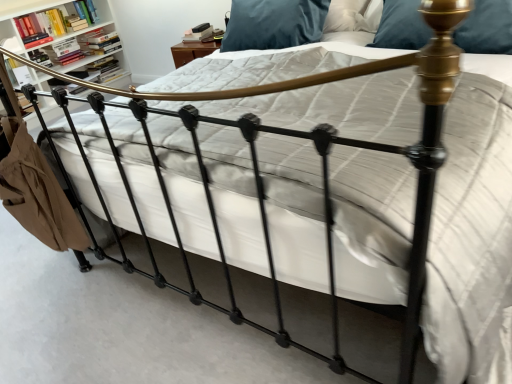
Describe the element at coordinates (99, 42) in the screenshot. This screenshot has height=384, width=512. I see `hardcover book at upper left, which is the 2th book in back-to-front order` at that location.

This screenshot has width=512, height=384. Describe the element at coordinates (55, 23) in the screenshot. I see `hardcover book at upper left, the first book viewed from the front` at that location.

This screenshot has width=512, height=384. What do you see at coordinates (54, 28) in the screenshot? I see `metallic bookshelf at upper left` at bounding box center [54, 28].

You are a GUI agent. You are given a task and a screenshot of the screen. Output one action in this format:
    pyautogui.click(x=<x>, y=<y>)
    Task: Click on the metallic bookshelf at upper left
    
    Given the screenshot: What is the action you would take?
    pyautogui.click(x=54, y=28)

Image resolution: width=512 pixels, height=384 pixels. In order to click on hardcover book at upper left, marked as the 2th book in a front-to-back arrangement in this screenshot , I will do `click(64, 52)`.

From a real-world perspective, which is physically above, hardcover book at upper left, which is the 3th book in back-to-front order, or metallic bookshelf at upper left?

In real-world perspective, hardcover book at upper left, which is the 3th book in back-to-front order, is above.

Choose the correct answer: Is hardcover book at upper left, marked as the 2th book in a front-to-back arrangement, inside metallic bookshelf at upper left or outside it?

hardcover book at upper left, marked as the 2th book in a front-to-back arrangement, is inside metallic bookshelf at upper left.

Looking at this image, considering the relative positions of hardcover book at upper left, which is the 3th book in back-to-front order, and metallic bookshelf at upper left in the image provided, is hardcover book at upper left, which is the 3th book in back-to-front order, to the right of metallic bookshelf at upper left from the viewer's perspective?

Yes.

Is hardcover book at upper left, the first book viewed from the front, looking in the opposite direction of metallic bookshelf at upper left?

That's right, hardcover book at upper left, the first book viewed from the front, is facing away from metallic bookshelf at upper left.

In the scene shown: From a real-world perspective, which object rests below the other?

From a 3D spatial view, metallic bookshelf at upper left is below.

How much distance is there between hardcover book at upper left, the 4th book when ordered from back to front, and metallic bookshelf at upper left?

The distance of hardcover book at upper left, the 4th book when ordered from back to front, from metallic bookshelf at upper left is 1.89 inches.

Is hardcover book at upper left, which is the 2th book in back-to-front order, to the left of velvet blue pillow at upper right from the viewer's perspective?

Indeed, hardcover book at upper left, which is the 2th book in back-to-front order, is positioned on the left side of velvet blue pillow at upper right.

Does point (104, 37) come farther from viewer compared to point (393, 4)?

That is True.

Can you confirm if hardcover book at upper left, which is the 2th book in back-to-front order, is shorter than velvet blue pillow at upper right?

Indeed, hardcover book at upper left, which is the 2th book in back-to-front order, has a lesser height compared to velvet blue pillow at upper right.

Is hardcover book at upper left, the 3th book from the front, oriented towards velvet blue pillow at upper right?

Yes.

From a real-world perspective, is hardcover book at upper left, marked as the 2th book in a front-to-back arrangement, under velvet blue pillow at upper right?

Indeed, from a real-world perspective, hardcover book at upper left, marked as the 2th book in a front-to-back arrangement, is positioned beneath velvet blue pillow at upper right.

Is hardcover book at upper left, which is the 3th book in back-to-front order, oriented away from velvet blue pillow at upper right?

That's not correct — hardcover book at upper left, which is the 3th book in back-to-front order, is not looking away from velvet blue pillow at upper right.

Who is smaller, hardcover book at upper left, which is the 3th book in back-to-front order, or velvet blue pillow at upper right?

hardcover book at upper left, which is the 3th book in back-to-front order.

Is hardcover book at upper left, marked as the 2th book in a front-to-back arrangement, far from velvet blue pillow at upper right?

Absolutely, hardcover book at upper left, marked as the 2th book in a front-to-back arrangement, is distant from velvet blue pillow at upper right.

What's the angular difference between hardcover books at upper left, placed as the fourth book when sorted from front to back, and velvet blue pillow at upper right's facing directions?

Result: 77.4 degrees.

Identify the location of book that is the 1st one when counting upward from the velvet blue pillow at upper right (from the image's perspective). (106, 69).

Can you confirm if hardcover books at upper left, placed as the fourth book when sorted from front to back, is wider than velvet blue pillow at upper right?

In fact, hardcover books at upper left, placed as the fourth book when sorted from front to back, might be narrower than velvet blue pillow at upper right.

Who is shorter, hardcover book at upper left, the 4th book when ordered from back to front, or hardcover book at upper left, the 3th book from the front?

Standing shorter between the two is hardcover book at upper left, the 3th book from the front.

Can you confirm if hardcover book at upper left, the first book viewed from the front, is thinner than hardcover book at upper left, which is the 2th book in back-to-front order?

Yes.

From the image's perspective, which one is positioned lower, hardcover book at upper left, the first book viewed from the front, or hardcover book at upper left, the 3th book from the front?

From the image's view, hardcover book at upper left, the first book viewed from the front, is below.

Looking at this image, does hardcover book at upper left, marked as the 2th book in a front-to-back arrangement, turn towards hardcover book at upper left, the 3th book from the front?

No, hardcover book at upper left, marked as the 2th book in a front-to-back arrangement, does not turn towards hardcover book at upper left, the 3th book from the front.

Considering the relative positions of hardcover book at upper left, which is the 3th book in back-to-front order, and hardcover book at upper left, the 3th book from the front, in the image provided, is hardcover book at upper left, which is the 3th book in back-to-front order, to the right of hardcover book at upper left, the 3th book from the front, from the viewer's perspective?

No, hardcover book at upper left, which is the 3th book in back-to-front order, is not to the right of hardcover book at upper left, the 3th book from the front.

The height and width of the screenshot is (384, 512). I want to click on the 1st book in front of the hardcover book at upper left, the 3th book from the front, starting your count from the anchor, so click(64, 52).

From a real-world perspective, is hardcover book at upper left, marked as the 2th book in a front-to-back arrangement, physically above hardcover book at upper left, the 3th book from the front?

Yes.

Identify the location of the 1st book counting from the right side of the metallic bookshelf at upper left. (64, 52).

Identify the location of the 1st book behind the metallic bookshelf at upper left, starting your count from the anchor. The height and width of the screenshot is (384, 512). (55, 23).

Considering their positions, is hardcover book at upper left, the 3th book from the front, positioned further to velvet blue pillow at upper right than hardcover book at upper left, which is the 3th book in back-to-front order?

Based on the image, hardcover book at upper left, the 3th book from the front, appears to be further to velvet blue pillow at upper right.

Considering their positions, is hardcover books at upper left, which is counted as the 1th book, starting from the back, positioned closer to hardcover book at upper left, which is the 3th book in back-to-front order, than velvet blue pillow at upper right?

hardcover books at upper left, which is counted as the 1th book, starting from the back, is closer to hardcover book at upper left, which is the 3th book in back-to-front order.

When comparing their distances from metallic bookshelf at upper left, does hardcover book at upper left, marked as the 2th book in a front-to-back arrangement, or hardcover book at upper left, the first book viewed from the front, seem further?

hardcover book at upper left, marked as the 2th book in a front-to-back arrangement.

Estimate the real-world distances between objects in this image. Which object is further from hardcover book at upper left, the first book viewed from the front, hardcover book at upper left, which is the 3th book in back-to-front order, or velvet blue pillow at upper right?

velvet blue pillow at upper right lies further to hardcover book at upper left, the first book viewed from the front, than the other object.

Estimate the real-world distances between objects in this image. Which object is closer to hardcover book at upper left, the first book viewed from the front, hardcover books at upper left, which is counted as the 1th book, starting from the back, or velvet blue pillow at upper right?

Based on the image, hardcover books at upper left, which is counted as the 1th book, starting from the back, appears to be nearer to hardcover book at upper left, the first book viewed from the front.

Which object lies further to the anchor point hardcover book at upper left, the 4th book when ordered from back to front, hardcover book at upper left, the 3th book from the front, or velvet blue pillow at upper right?

velvet blue pillow at upper right.

Which object lies further to the anchor point hardcover book at upper left, the 3th book from the front, hardcover book at upper left, marked as the 2th book in a front-to-back arrangement, or velvet blue pillow at upper right?

Among the two, velvet blue pillow at upper right is located further to hardcover book at upper left, the 3th book from the front.

When comparing their distances from hardcover book at upper left, the first book viewed from the front, does metallic bookshelf at upper left or hardcover book at upper left, the 3th book from the front, seem closer?

Among the two, metallic bookshelf at upper left is located nearer to hardcover book at upper left, the first book viewed from the front.

In order to click on book located between metallic bookshelf at upper left and hardcover book at upper left, marked as the 2th book in a front-to-back arrangement, in the depth direction in this screenshot , I will do `click(55, 23)`.

This screenshot has height=384, width=512. In order to click on book between hardcover book at upper left, which is the 3th book in back-to-front order, and hardcover books at upper left, placed as the fourth book when sorted from front to back, in the horizontal direction in this screenshot , I will do `click(99, 42)`.

The image size is (512, 384). Identify the location of book between hardcover book at upper left, the 4th book when ordered from back to front, and hardcover book at upper left, which is the 2th book in back-to-front order, in the front-back direction. (64, 52).

Locate an element on the screen. The height and width of the screenshot is (384, 512). shelf between hardcover book at upper left, the 4th book when ordered from back to front, and velvet blue pillow at upper right, in the horizontal direction is located at coordinates (54, 28).